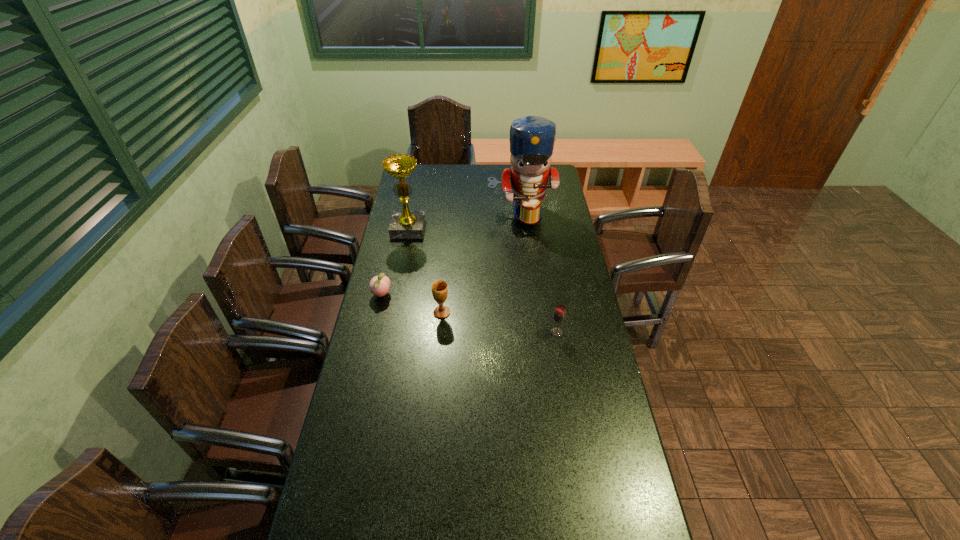
Where is `vacant space located 0.210m on the front of the nearest object`? vacant space located 0.210m on the front of the nearest object is located at coordinates (566, 389).

Locate an element on the screen. free point located 0.300m on the right of the peach is located at coordinates (469, 295).

This screenshot has height=540, width=960. I want to click on award situated at the left edge, so click(x=405, y=224).

The height and width of the screenshot is (540, 960). Identify the location of peach present at the left edge. (379, 285).

At what (x,y) coordinates should I click in order to perform the action: click on nutcracker that is positioned at the right edge. Please return your answer as a coordinate pair (x, y). Looking at the image, I should click on pyautogui.click(x=532, y=138).

Find the location of a particular element. The width and height of the screenshot is (960, 540). glass drink container at the right edge is located at coordinates (559, 315).

The height and width of the screenshot is (540, 960). In the image, there is a desktop. In order to click on vacant space at the far edge in this screenshot , I will do `click(485, 186)`.

This screenshot has height=540, width=960. I want to click on vacant space at the left edge of the desktop, so click(x=372, y=314).

Where is `vacant region at the right edge of the desktop`? vacant region at the right edge of the desktop is located at coordinates (561, 366).

Find the location of a particular element. This screenshot has width=960, height=540. free space between the third nearest object and the second tallest object is located at coordinates (395, 262).